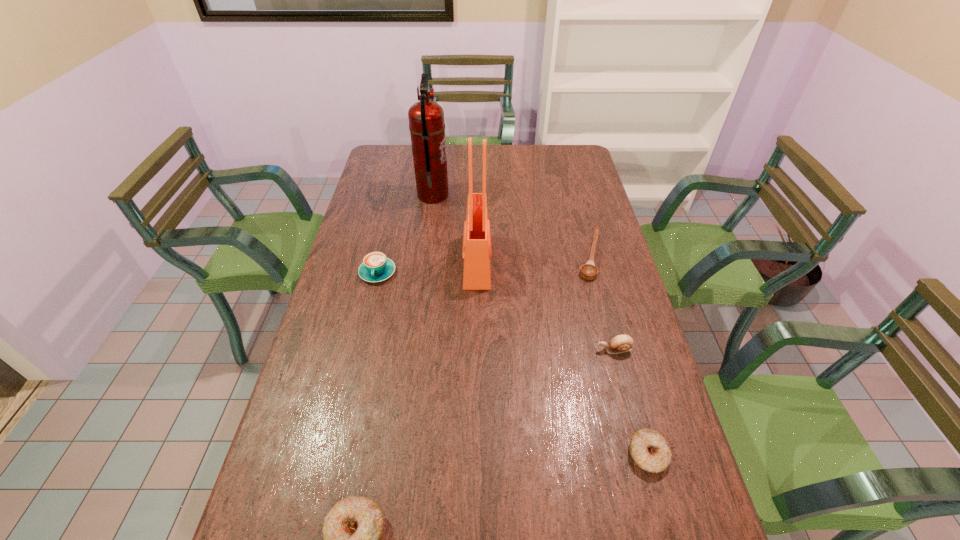
The image size is (960, 540). In order to click on vacant point located with the handle on the right side of the cappuccino in this screenshot , I will do `click(371, 302)`.

Image resolution: width=960 pixels, height=540 pixels. I want to click on free location located on the left of the shortest object, so click(x=487, y=256).

Identify the location of vacant space located on the front-facing side of the escargot. (510, 350).

At what (x,y) coordinates should I click in order to perform the action: click on free region located 0.140m on the front-facing side of the escargot. Please return your answer as a coordinate pair (x, y). Image resolution: width=960 pixels, height=540 pixels. Looking at the image, I should click on (546, 350).

Identify the location of free space located on the front-facing side of the escargot. The image size is (960, 540). (506, 350).

Image resolution: width=960 pixels, height=540 pixels. I want to click on object that is positioned at the left edge, so click(x=376, y=267).

Identify the location of doughnut present at the right edge. The height and width of the screenshot is (540, 960). (649, 449).

Find the location of `wooden spoon that is at the right edge`. wooden spoon that is at the right edge is located at coordinates (589, 271).

Where is `escargot that is at the right edge`? escargot that is at the right edge is located at coordinates (622, 343).

Locate an element on the screen. The image size is (960, 540). vacant space at the far edge of the desktop is located at coordinates (509, 163).